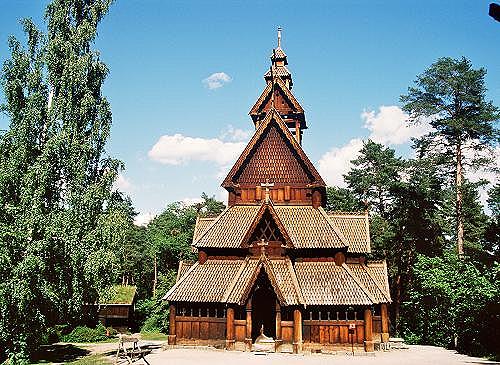
This screenshot has height=365, width=500. I want to click on support beams, so click(364, 348), click(382, 336), click(313, 348), click(297, 349), click(226, 332), click(244, 329).